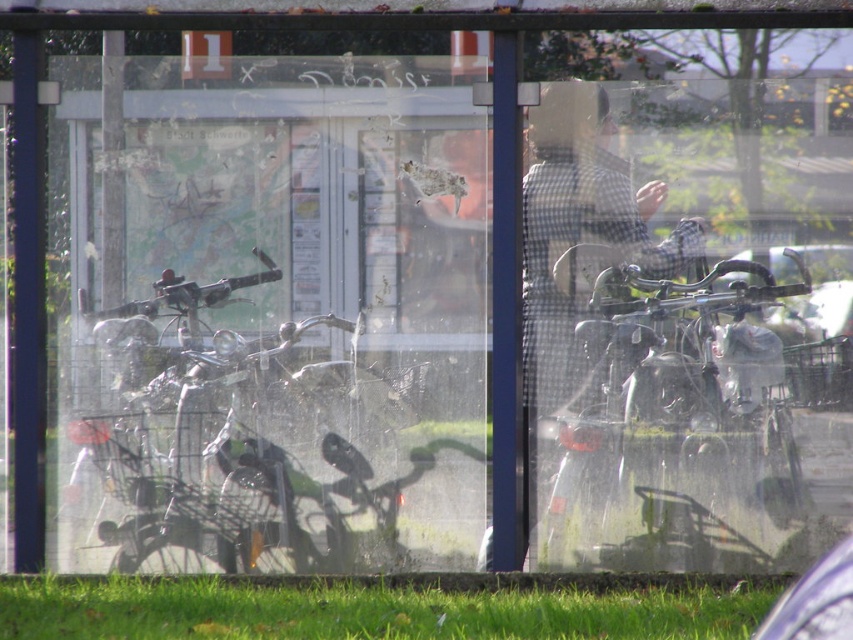
Question: Which of the following is the closest to the observer?

Choices:
 (A) metallic silver motorcycle at center
 (B) metallic gun at left
 (C) metallic silver motorcycle at left
 (D) green grass at lower center

Answer: (D)

Question: Is green grass at lower center above metallic gun at left?

Choices:
 (A) no
 (B) yes

Answer: (A)

Question: Which of the following is the closest to the observer?

Choices:
 (A) metallic gun at left
 (B) metallic silver motorcycle at left
 (C) metallic silver motorcycle at center

Answer: (C)

Question: Is metallic silver motorcycle at left smaller than green grass at lower center?

Choices:
 (A) no
 (B) yes

Answer: (B)

Question: Is metallic silver motorcycle at left to the right of metallic silver motorcycle at center from the viewer's perspective?

Choices:
 (A) yes
 (B) no

Answer: (B)

Question: Which point appears closest to the camera in this image?

Choices:
 (A) (294, 595)
 (B) (247, 282)

Answer: (A)